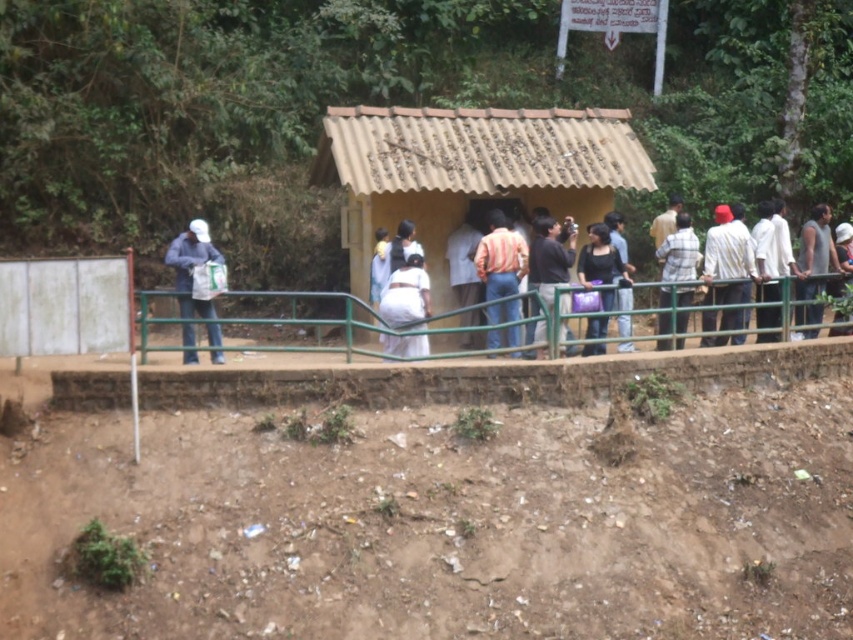
Is striped cotton shirt at center bigger than matte blue jacket at left?

Indeed, striped cotton shirt at center has a larger size compared to matte blue jacket at left.

Between striped cotton shirt at center and matte blue jacket at left, which one has more height?

striped cotton shirt at center is taller.

This screenshot has height=640, width=853. Find the location of `striped cotton shirt at center`. striped cotton shirt at center is located at coordinates (500, 257).

I want to click on striped cotton shirt at center, so click(x=500, y=257).

Can you confirm if brown dirt track at lower center is taller than matte black shirt at center?

No, brown dirt track at lower center is not taller than matte black shirt at center.

Is point (386, 433) less distant than point (596, 248)?

Yes, it is.

Identify the location of brown dirt track at lower center. The height and width of the screenshot is (640, 853). (444, 525).

Who is more distant from viewer, (538, 156) or (543, 349)?

Positioned behind is point (538, 156).

Consider the image. Does brown corrugated roof hut at center have a smaller size compared to black matte shirt at center?

No.

Between point (503, 129) and point (538, 284), which one is positioned behind?

The point (503, 129) is behind.

Image resolution: width=853 pixels, height=640 pixels. Find the location of `brown corrugated roof hut at center`. brown corrugated roof hut at center is located at coordinates (469, 172).